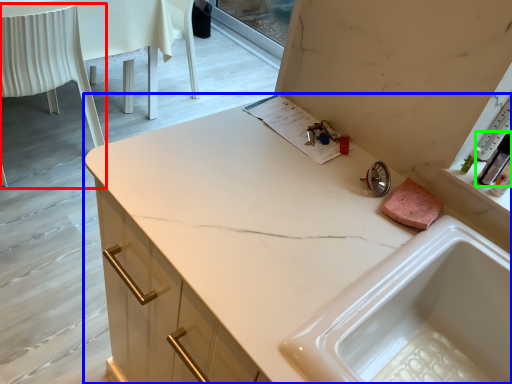
Question: Which is farther away from chair (highlighted by a red box)? countertop (highlighted by a blue box) or toiletry (highlighted by a green box)?

Choices:
 (A) countertop
 (B) toiletry

Answer: (B)